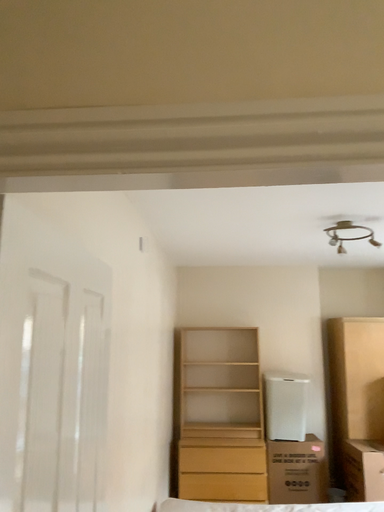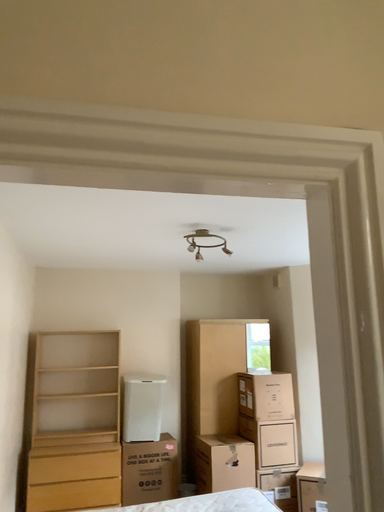
Question: Which way did the camera rotate in the video?

Choices:
 (A) rotated left
 (B) rotated right

Answer: (B)